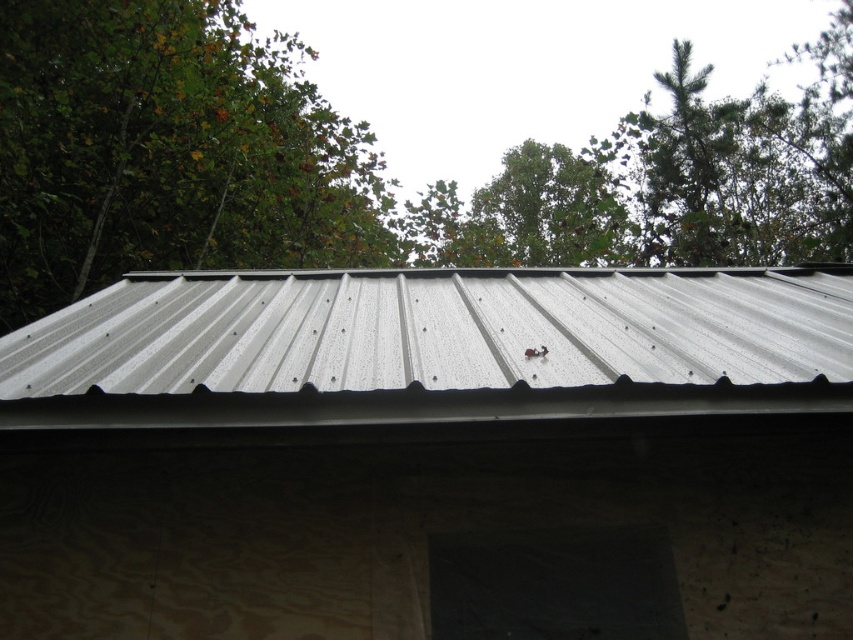
Question: Which object is farther from the camera taking this photo?

Choices:
 (A) green leafy tree at upper center
 (B) green leafy tree at upper left
 (C) metallic gray roof at center

Answer: (B)

Question: Among these objects, which one is nearest to the camera?

Choices:
 (A) metallic gray roof at center
 (B) green leafy tree at upper left
 (C) green leafy tree at upper center

Answer: (A)

Question: Considering the relative positions of green leafy tree at upper center and green leafy tree at upper left in the image provided, where is green leafy tree at upper center located with respect to green leafy tree at upper left?

Choices:
 (A) above
 (B) below

Answer: (A)

Question: Does green leafy tree at upper center have a smaller size compared to green leafy tree at upper left?

Choices:
 (A) yes
 (B) no

Answer: (B)

Question: Where is green leafy tree at upper center located in relation to green leafy tree at upper left in the image?

Choices:
 (A) right
 (B) left

Answer: (A)

Question: Based on their relative distances, which object is nearer to the green leafy tree at upper left?

Choices:
 (A) green leafy tree at upper center
 (B) metallic gray roof at center

Answer: (B)